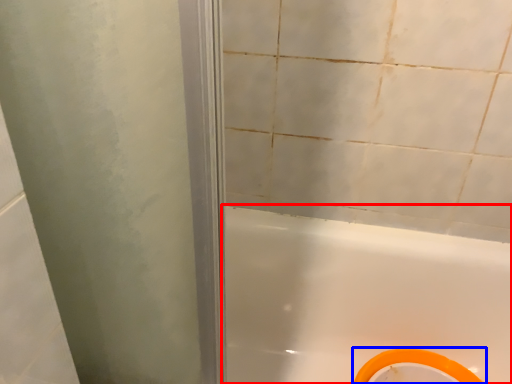
Question: Among these objects, which one is farthest to the camera, bathtub (highlighted by a red box) or bidet (highlighted by a blue box)?

Choices:
 (A) bathtub
 (B) bidet

Answer: (B)